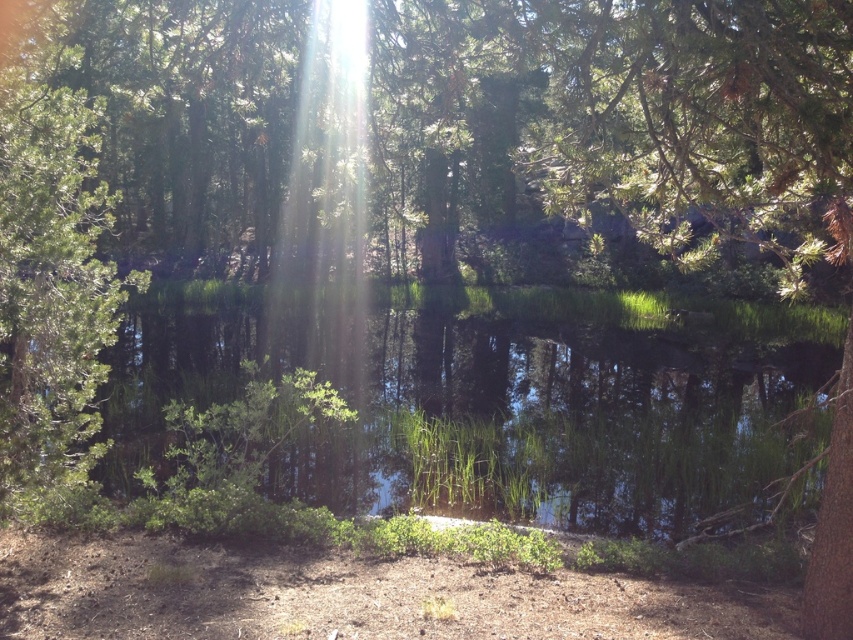
You are an environmental scientist studying the forest. You observe the green matte tree at upper center and the green reflective water at center. Which object has a greater width in the image?

The green matte tree at upper center has a greater width than the green reflective water at center.

You are standing in the forest scene and want to reach the point marked as point (202, 77). If you can walk 5 feet per minute, how long will it take you to reach that point?

The point (202, 77) is 41.01 feet from the camera, so it will take approximately 8.2 minutes to reach it since 41.01 divided by 5 equals 8.202 minutes.